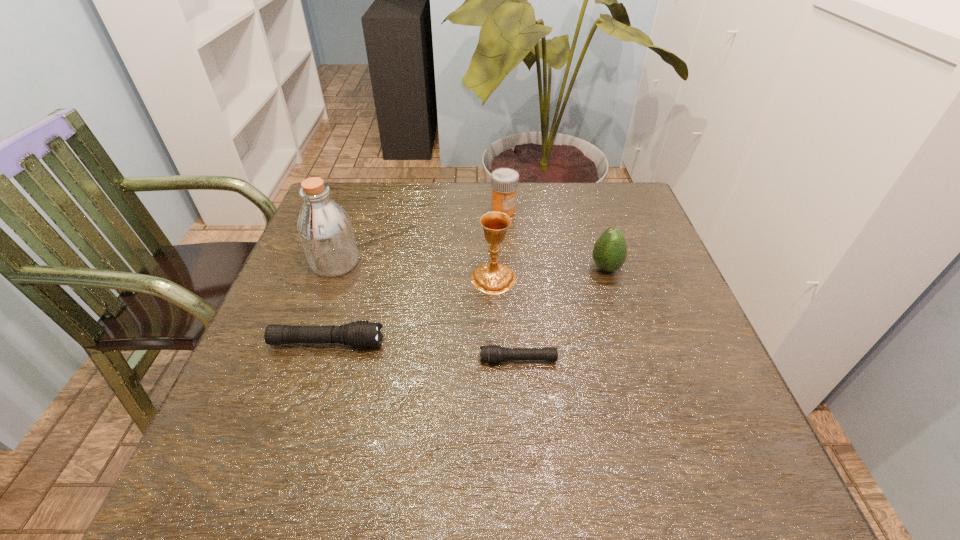
I want to click on vacant area at the far edge of the desktop, so click(545, 228).

Image resolution: width=960 pixels, height=540 pixels. What are the coordinates of `vacant space at the near edge of the desktop` in the screenshot? It's located at (419, 428).

In the image, there is a desktop. At what (x,y) coordinates should I click in order to perform the action: click on blank space at the left edge. Please return your answer as a coordinate pair (x, y). The height and width of the screenshot is (540, 960). Looking at the image, I should click on (288, 359).

Find the location of a particular element. The width and height of the screenshot is (960, 540). blank space at the right edge of the desktop is located at coordinates (652, 310).

In the image, there is a desktop. At what (x,y) coordinates should I click in order to perform the action: click on vacant space at the far right corner. Please return your answer as a coordinate pair (x, y). The height and width of the screenshot is (540, 960). Looking at the image, I should click on (626, 214).

You are a GUI agent. You are given a task and a screenshot of the screen. Output one action in this format:
    pyautogui.click(x=<x>, y=<y>)
    Task: Click on the vacant area between the fifth shortest object and the rightmost object
    
    Given the screenshot: What is the action you would take?
    pyautogui.click(x=550, y=273)

Where is `free spot between the second tallest object and the tallest object`? Image resolution: width=960 pixels, height=540 pixels. free spot between the second tallest object and the tallest object is located at coordinates (415, 271).

I want to click on vacant area that lies between the left flashlight and the shorter flashlight, so click(x=422, y=351).

You are a GUI agent. You are given a task and a screenshot of the screen. Output one action in this format:
    pyautogui.click(x=<x>, y=<y>)
    Task: Click on the empty location between the fifth tallest object and the bottle
    The width and height of the screenshot is (960, 540).
    Given the screenshot: What is the action you would take?
    point(331,303)

The width and height of the screenshot is (960, 540). What are the coordinates of `unoccupied area between the left flashlight and the medicine` in the screenshot? It's located at (416, 276).